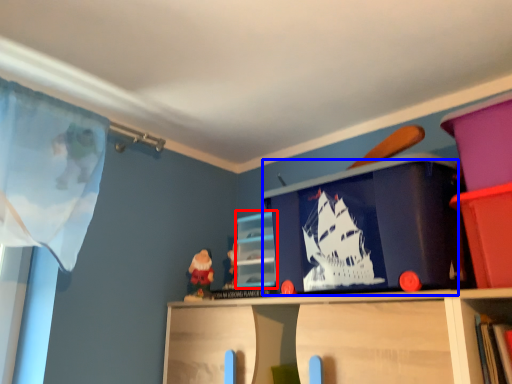
Question: Which object appears farthest to the camera in this image, cabinet (highlighted by a red box) or window screen (highlighted by a blue box)?

Choices:
 (A) cabinet
 (B) window screen

Answer: (A)